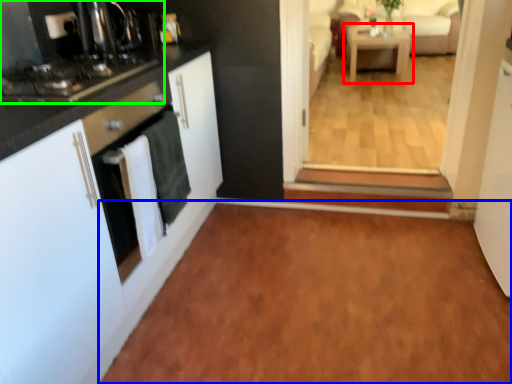
Question: Based on their relative distances, which object is nearer to table (highlighted by a red box)? Choose from plain (highlighted by a blue box) and home appliance (highlighted by a green box).

Choices:
 (A) plain
 (B) home appliance

Answer: (A)